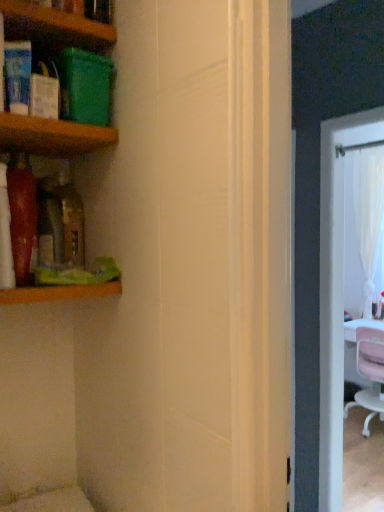
Question: Does wooden shelf at upper left, arranged as the 2th shelf when ordered from the bottom, have a larger size compared to wooden shelf at upper left, the 1th shelf positioned from the top?

Choices:
 (A) yes
 (B) no

Answer: (B)

Question: Does wooden shelf at upper left, arranged as the 2th shelf when ordered from the bottom, have a greater width compared to wooden shelf at upper left, which appears as the third shelf when ordered from the bottom?

Choices:
 (A) yes
 (B) no

Answer: (B)

Question: Can you confirm if wooden shelf at upper left, the 2th shelf viewed from the top, is taller than wooden shelf at upper left, the 1th shelf positioned from the top?

Choices:
 (A) no
 (B) yes

Answer: (A)

Question: From a real-world perspective, is wooden shelf at upper left, the 2th shelf viewed from the top, located higher than wooden shelf at upper left, which appears as the third shelf when ordered from the bottom?

Choices:
 (A) yes
 (B) no

Answer: (B)

Question: From the image's perspective, is wooden shelf at upper left, the 2th shelf viewed from the top, beneath wooden shelf at upper left, which appears as the third shelf when ordered from the bottom?

Choices:
 (A) no
 (B) yes

Answer: (B)

Question: From a real-world perspective, does wooden shelf at upper left, arranged as the 2th shelf when ordered from the bottom, sit lower than wooden shelf at upper left, which appears as the third shelf when ordered from the bottom?

Choices:
 (A) no
 (B) yes

Answer: (B)

Question: Is wooden shelf at upper left, the 2th shelf viewed from the top, at the back of pink fabric chair at right?

Choices:
 (A) no
 (B) yes

Answer: (B)

Question: Is pink fabric chair at right next to wooden shelf at upper left, the 2th shelf viewed from the top, and touching it?

Choices:
 (A) no
 (B) yes

Answer: (A)

Question: Can you confirm if pink fabric chair at right is thinner than wooden shelf at upper left, arranged as the 2th shelf when ordered from the bottom?

Choices:
 (A) yes
 (B) no

Answer: (B)

Question: Is pink fabric chair at right positioned beyond the bounds of wooden shelf at upper left, arranged as the 2th shelf when ordered from the bottom?

Choices:
 (A) no
 (B) yes

Answer: (B)

Question: From the image's perspective, would you say pink fabric chair at right is positioned over wooden shelf at upper left, the 2th shelf viewed from the top?

Choices:
 (A) no
 (B) yes

Answer: (A)

Question: Is wooden shelf at upper left, arranged as the 2th shelf when ordered from the bottom, completely or partially inside pink fabric chair at right?

Choices:
 (A) no
 (B) yes

Answer: (A)

Question: Does wooden shelf at upper left, which appears as the third shelf when ordered from the bottom, have a smaller size compared to wooden shelf at upper left, arranged as the 2th shelf when ordered from the bottom?

Choices:
 (A) no
 (B) yes

Answer: (A)